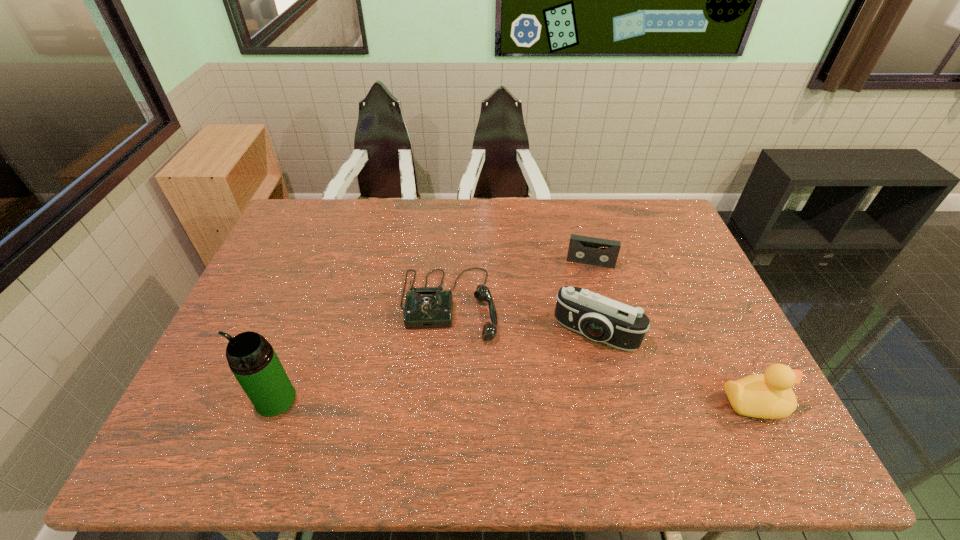
Locate an element on the screen. free space located 0.090m on the dial of the telephone is located at coordinates [x=448, y=375].

The width and height of the screenshot is (960, 540). I want to click on vacant area situated on the dial of the telephone, so pos(448,372).

In order to click on vacant space located 0.180m on the dial of the telephone in this screenshot , I will do `click(447, 408)`.

Identify the location of vacant space located 0.260m on the front-facing side of the farthest object. The height and width of the screenshot is (540, 960). (580, 332).

The height and width of the screenshot is (540, 960). I want to click on free space located 0.340m on the front-facing side of the farthest object, so pyautogui.click(x=577, y=355).

Where is `vacant space located on the front-facing side of the farthest object`? The image size is (960, 540). vacant space located on the front-facing side of the farthest object is located at coordinates (582, 313).

The image size is (960, 540). What are the coordinates of `vacant space located on the front lens of the camera` in the screenshot? It's located at (561, 390).

Identify the location of free space located 0.140m on the front lens of the camera. point(560,393).

This screenshot has width=960, height=540. Find the location of `free spot located on the front lens of the camera`. free spot located on the front lens of the camera is located at coordinates (571, 368).

Where is `thermos bottle that is at the near edge`? thermos bottle that is at the near edge is located at coordinates (251, 358).